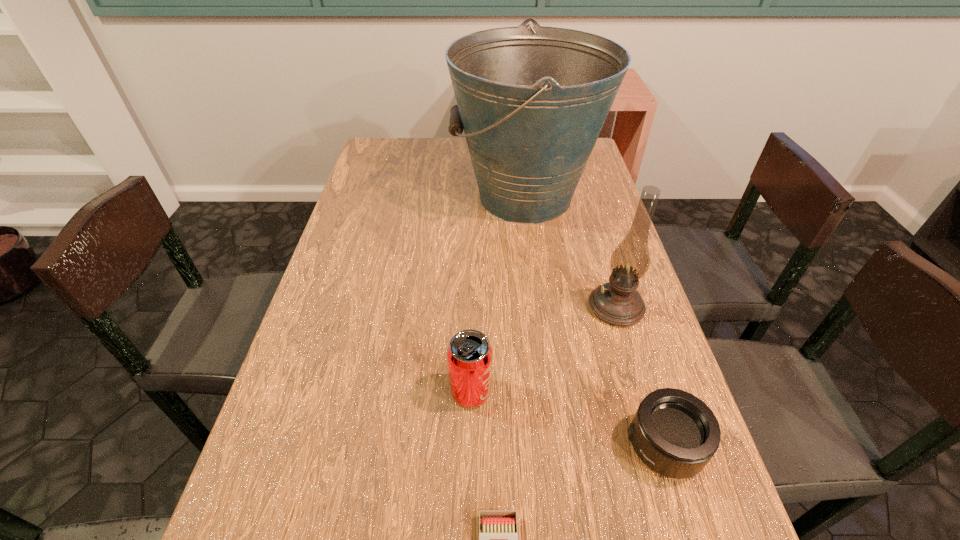
Where is `object situated at the far right corner`? This screenshot has height=540, width=960. object situated at the far right corner is located at coordinates (532, 102).

Find the location of `vacant region at the far edge of the desktop`. vacant region at the far edge of the desktop is located at coordinates (467, 147).

Where is `free space at the left edge of the desktop`? free space at the left edge of the desktop is located at coordinates (334, 274).

Locate an element on the screen. vacant area at the right edge is located at coordinates coord(611,338).

This screenshot has width=960, height=540. What are the coordinates of `free location at the far left corner` in the screenshot? It's located at (367, 154).

Locate an element on the screen. unoccupied area between the farthest object and the third farthest object is located at coordinates (498, 295).

You are a GUI agent. You are given a task and a screenshot of the screen. Output one action in this format:
    pyautogui.click(x=<x>, y=<y>)
    Task: Click on the vacant region between the second tallest object and the bucket
    The image size is (960, 540).
    Given the screenshot: What is the action you would take?
    pyautogui.click(x=570, y=252)

The image size is (960, 540). Find the location of `free space between the fourth shortest object and the bucket`. free space between the fourth shortest object and the bucket is located at coordinates (570, 252).

The width and height of the screenshot is (960, 540). I want to click on free spot between the second tallest object and the tallest object, so click(570, 252).

Locate an element on the screen. The image size is (960, 540). free spot between the tallest object and the soda can is located at coordinates (498, 295).